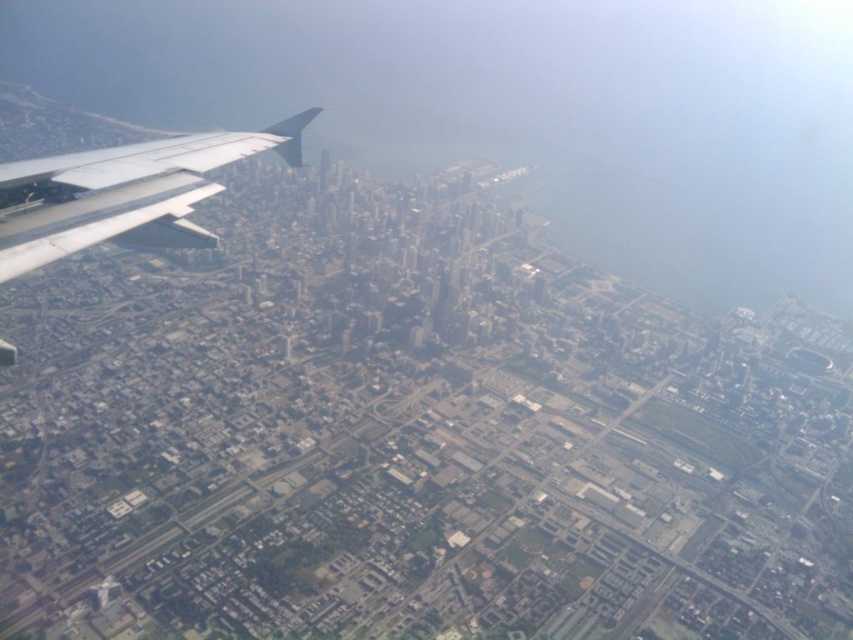
Who is positioned more to the left, transparent glass cityscape at upper center or silver metallic wing at upper left?

From the viewer's perspective, silver metallic wing at upper left appears more on the left side.

Who is taller, transparent glass cityscape at upper center or silver metallic wing at upper left?

With more height is transparent glass cityscape at upper center.

Where is `transparent glass cityscape at upper center`? transparent glass cityscape at upper center is located at coordinates (521, 109).